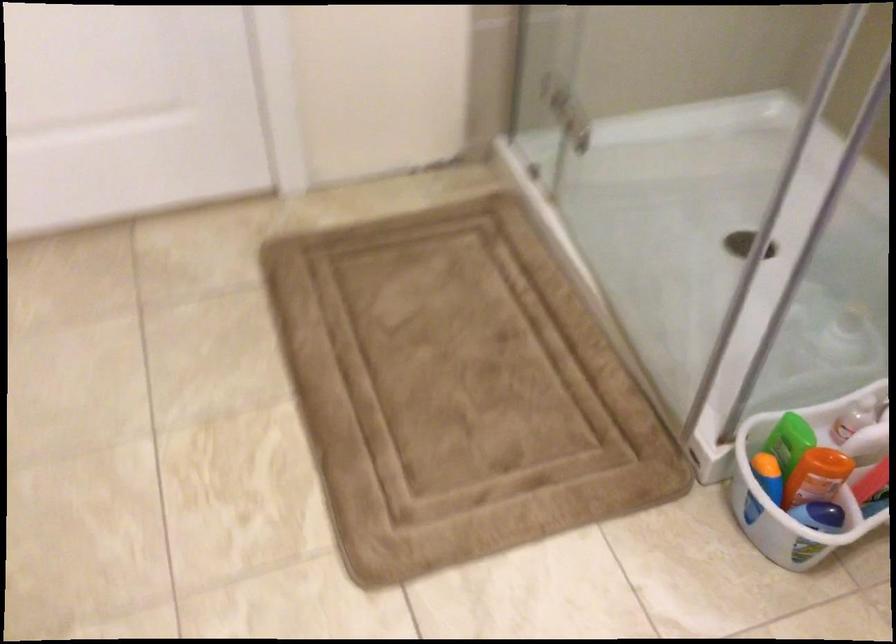
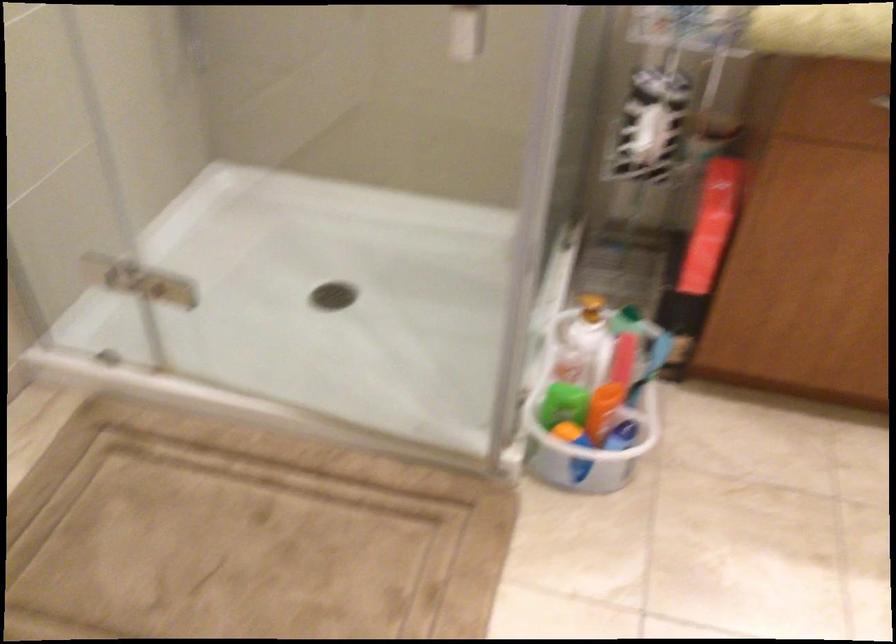
Locate, in the second image, the point that corresponds to the point at 789,444 in the first image.

(563, 402)